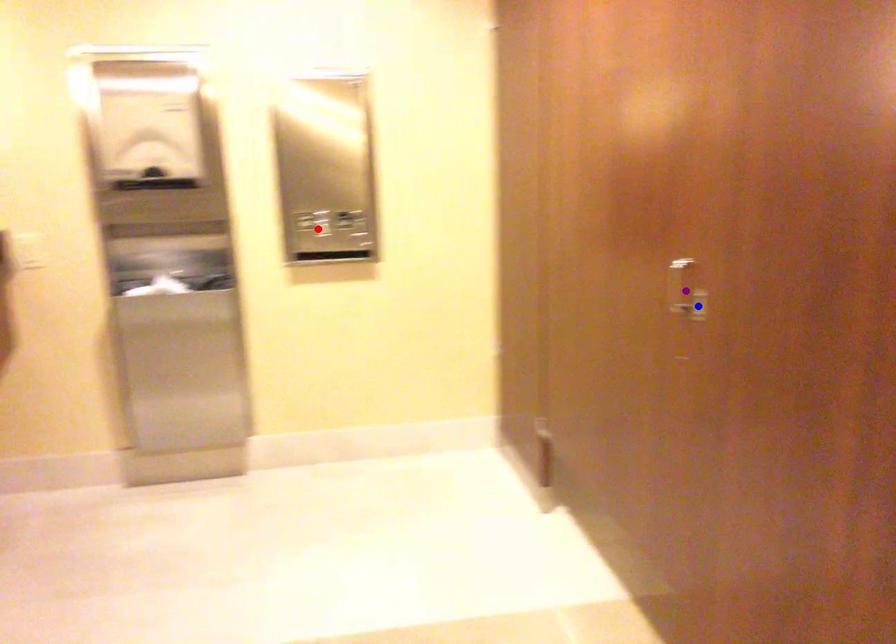
Order these from farthest to nearest:
red point, blue point, purple point

red point < purple point < blue point